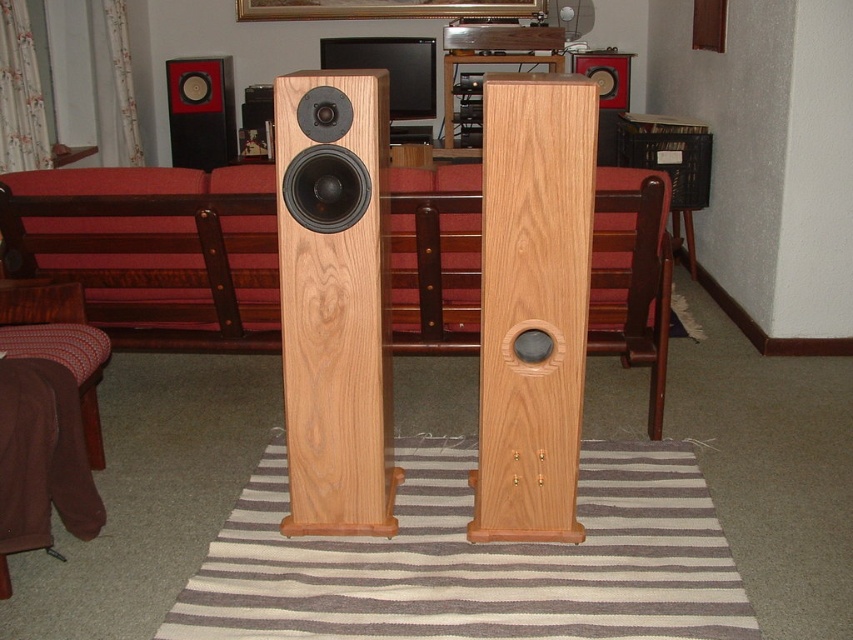
You are standing in the living room and see the point marked at coordinates [335,300]. What object is located at that point?

The point at coordinates [335,300] indicates the natural wood speaker at center.

You are setting up a stereo system and need to place two matte black speakers. Based on the image, which speaker, the matte black speaker at upper left or the matte black speaker at upper center, is wider?

The matte black speaker at upper left might be wider than the matte black speaker at upper center according to the image description.